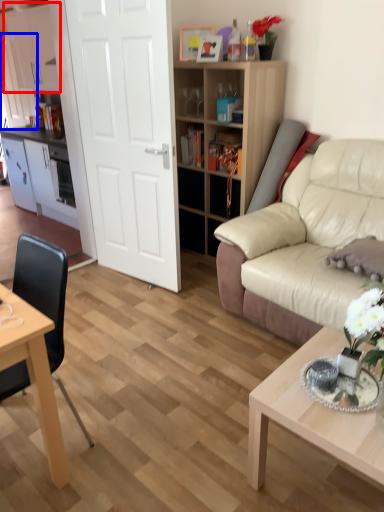
Question: Which of the following is the closest to the observer, cabinetry (highlighted by a red box) or cabinetry (highlighted by a blue box)?

Choices:
 (A) cabinetry
 (B) cabinetry

Answer: (A)